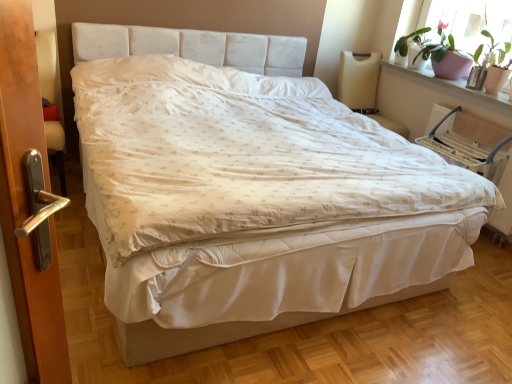
Locate an element on the screen. Image resolution: width=512 pixels, height=384 pixels. pink ceramic pot at upper right is located at coordinates (470, 21).

The width and height of the screenshot is (512, 384). What are the coordinates of `white fabric armchair at right, marked as the 2th armchair in a left-to-right arrangement` in the screenshot? It's located at point(471,144).

Locate an element on the screen. The height and width of the screenshot is (384, 512). white fabric bed frame at center is located at coordinates (281, 280).

This screenshot has width=512, height=384. What are the coordinates of `the 1st armchair above when counting from the white fabric bed frame at center (from the image's perspective)` in the screenshot? It's located at (471, 144).

Considering the sizes of objects white fabric bed frame at center and white fabric armchair at right, the 1th armchair viewed from the right, in the image provided, who is thinner, white fabric bed frame at center or white fabric armchair at right, the 1th armchair viewed from the right,?

With smaller width is white fabric armchair at right, the 1th armchair viewed from the right.

Which object is further away from the camera taking this photo, white fabric bed frame at center or white fabric armchair at right, the 1th armchair viewed from the right?

white fabric armchair at right, the 1th armchair viewed from the right, is more distant.

Does point (350, 287) come farther from viewer compared to point (450, 154)?

No, it is in front of (450, 154).

From the image's perspective, is white fabric armchair at right, the 1th armchair viewed from the right, positioned above or below pink ceramic pot at upper right?

From the image's perspective, white fabric armchair at right, the 1th armchair viewed from the right, appears below pink ceramic pot at upper right.

Looking at this image, is white fabric armchair at right, marked as the 2th armchair in a left-to-right arrangement, oriented away from pink ceramic pot at upper right?

white fabric armchair at right, marked as the 2th armchair in a left-to-right arrangement, is not turned away from pink ceramic pot at upper right.

Does point (478, 132) lie in front of point (461, 79)?

Yes, it is in front of point (461, 79).

Who is smaller, white fabric armchair at right, marked as the 2th armchair in a left-to-right arrangement, or pink ceramic pot at upper right?

pink ceramic pot at upper right is smaller.

Is pink ceramic pot at upper right taller than beige fabric armchair at upper right, the second armchair in the right-to-left sequence?

No.

How far apart are pink ceramic pot at upper right and beige fabric armchair at upper right, the second armchair in the right-to-left sequence?

The distance of pink ceramic pot at upper right from beige fabric armchair at upper right, the second armchair in the right-to-left sequence, is 16.45 inches.

From a real-world perspective, who is located higher, pink ceramic pot at upper right or beige fabric armchair at upper right, the 1th armchair from the left?

pink ceramic pot at upper right.

From the image's perspective, is pink ceramic pot at upper right located above or below beige fabric armchair at upper right, the 1th armchair from the left?

Clearly, from the image's perspective, pink ceramic pot at upper right is above beige fabric armchair at upper right, the 1th armchair from the left.

Which object is closer to the camera, white fabric armchair at right, marked as the 2th armchair in a left-to-right arrangement, or beige fabric armchair at upper right, the second armchair in the right-to-left sequence?

white fabric armchair at right, marked as the 2th armchair in a left-to-right arrangement.

Find the location of a particular element. The height and width of the screenshot is (384, 512). armchair in front of the beige fabric armchair at upper right, the second armchair in the right-to-left sequence is located at coordinates (471, 144).

Is white fabric armchair at right, marked as the 2th armchair in a left-to-right arrangement, facing towards beige fabric armchair at upper right, the 1th armchair from the left?

No, white fabric armchair at right, marked as the 2th armchair in a left-to-right arrangement, is not facing towards beige fabric armchair at upper right, the 1th armchair from the left.

Between pink ceramic pot at upper right and white fabric bed frame at center, which one has less height?

white fabric bed frame at center is shorter.

Does pink ceramic pot at upper right have a larger size compared to white fabric bed frame at center?

Incorrect, pink ceramic pot at upper right is not larger than white fabric bed frame at center.

Is pink ceramic pot at upper right directly adjacent to white fabric bed frame at center?

No, pink ceramic pot at upper right is not with white fabric bed frame at center.

In the image, is pink ceramic pot at upper right on the left side or the right side of white fabric bed frame at center?

From the image, it's evident that pink ceramic pot at upper right is to the right of white fabric bed frame at center.

This screenshot has height=384, width=512. Find the location of `armchair that is the 1st object to the left of the pink ceramic pot at upper right, starting at the anchor`. armchair that is the 1st object to the left of the pink ceramic pot at upper right, starting at the anchor is located at coordinates pos(471,144).

From the image's perspective, between pink ceramic pot at upper right and white fabric armchair at right, marked as the 2th armchair in a left-to-right arrangement, who is located below?

Answer: white fabric armchair at right, marked as the 2th armchair in a left-to-right arrangement, appears lower in the image.

From a real-world perspective, is pink ceramic pot at upper right under white fabric armchair at right, the 1th armchair viewed from the right?

No, from a real-world perspective, pink ceramic pot at upper right is not beneath white fabric armchair at right, the 1th armchair viewed from the right.

From the image's perspective, would you say beige fabric armchair at upper right, the second armchair in the right-to-left sequence, is positioned over white fabric armchair at right, marked as the 2th armchair in a left-to-right arrangement?

Yes, from the image's perspective, beige fabric armchair at upper right, the second armchair in the right-to-left sequence, is above white fabric armchair at right, marked as the 2th armchair in a left-to-right arrangement.

Is beige fabric armchair at upper right, the 1th armchair from the left, next to white fabric armchair at right, the 1th armchair viewed from the right?

No, beige fabric armchair at upper right, the 1th armchair from the left, is not with white fabric armchair at right, the 1th armchair viewed from the right.

Do you think beige fabric armchair at upper right, the second armchair in the right-to-left sequence, is within white fabric armchair at right, marked as the 2th armchair in a left-to-right arrangement, or outside of it?

beige fabric armchair at upper right, the second armchair in the right-to-left sequence, is spatially situated outside white fabric armchair at right, marked as the 2th armchair in a left-to-right arrangement.

Between beige fabric armchair at upper right, the 1th armchair from the left, and white fabric armchair at right, the 1th armchair viewed from the right, which one has larger width?

beige fabric armchair at upper right, the 1th armchair from the left, is wider.

You are a GUI agent. You are given a task and a screenshot of the screen. Output one action in this format:
    pyautogui.click(x=<x>, y=<y>)
    Task: Click on the bed frame on the left of white fabric armchair at right, the 1th armchair viewed from the right
    
    Given the screenshot: What is the action you would take?
    pyautogui.click(x=281, y=280)

From the image's perspective, starting from the pink ceramic pot at upper right, which armchair is the 2nd one below? Please provide its 2D coordinates.

[(471, 144)]

When comparing their distances from pink ceramic pot at upper right, does white fabric armchair at right, the 1th armchair viewed from the right, or white fabric bed frame at center seem closer?

Based on the image, white fabric armchair at right, the 1th armchair viewed from the right, appears to be nearer to pink ceramic pot at upper right.

Which object lies nearer to the anchor point beige fabric armchair at upper right, the second armchair in the right-to-left sequence, white fabric bed frame at center or white fabric armchair at right, marked as the 2th armchair in a left-to-right arrangement?

Among the two, white fabric armchair at right, marked as the 2th armchair in a left-to-right arrangement, is located nearer to beige fabric armchair at upper right, the second armchair in the right-to-left sequence.

Estimate the real-world distances between objects in this image. Which object is closer to white fabric bed frame at center, pink ceramic pot at upper right or white fabric armchair at right, marked as the 2th armchair in a left-to-right arrangement?

white fabric armchair at right, marked as the 2th armchair in a left-to-right arrangement.

Based on the photo, which object lies further to the anchor point beige fabric armchair at upper right, the second armchair in the right-to-left sequence, pink ceramic pot at upper right or white fabric armchair at right, the 1th armchair viewed from the right?

white fabric armchair at right, the 1th armchair viewed from the right, lies further to beige fabric armchair at upper right, the second armchair in the right-to-left sequence, than the other object.

From the image, which object appears to be nearer to white fabric armchair at right, marked as the 2th armchair in a left-to-right arrangement, beige fabric armchair at upper right, the second armchair in the right-to-left sequence, or pink ceramic pot at upper right?

Among the two, pink ceramic pot at upper right is located nearer to white fabric armchair at right, marked as the 2th armchair in a left-to-right arrangement.

Estimate the real-world distances between objects in this image. Which object is further from pink ceramic pot at upper right, white fabric armchair at right, marked as the 2th armchair in a left-to-right arrangement, or beige fabric armchair at upper right, the 1th armchair from the left?

beige fabric armchair at upper right, the 1th armchair from the left, lies further to pink ceramic pot at upper right than the other object.

Estimate the real-world distances between objects in this image. Which object is closer to pink ceramic pot at upper right, pink ceramic pot at upper right or beige fabric armchair at upper right, the second armchair in the right-to-left sequence?

pink ceramic pot at upper right.

Which object lies nearer to the anchor point white fabric armchair at right, the 1th armchair viewed from the right, white fabric bed frame at center or pink ceramic pot at upper right?

pink ceramic pot at upper right.

Where is `armchair between pink ceramic pot at upper right and white fabric armchair at right, marked as the 2th armchair in a left-to-right arrangement, from top to bottom`? The height and width of the screenshot is (384, 512). armchair between pink ceramic pot at upper right and white fabric armchair at right, marked as the 2th armchair in a left-to-right arrangement, from top to bottom is located at coordinates (362, 87).

Identify the location of armchair between white fabric bed frame at center and pink ceramic pot at upper right along the z-axis. Image resolution: width=512 pixels, height=384 pixels. (471, 144).

Find the location of a particular element. This screenshot has height=384, width=512. window screen located between white fabric bed frame at center and beige fabric armchair at upper right, the second armchair in the right-to-left sequence, in the depth direction is located at coordinates (470, 21).

Find the location of `window sill between pink ceramic pot at upper right and white fabric armchair at right, marked as the 2th armchair in a left-to-right arrangement, vertically`. window sill between pink ceramic pot at upper right and white fabric armchair at right, marked as the 2th armchair in a left-to-right arrangement, vertically is located at coordinates (453, 85).